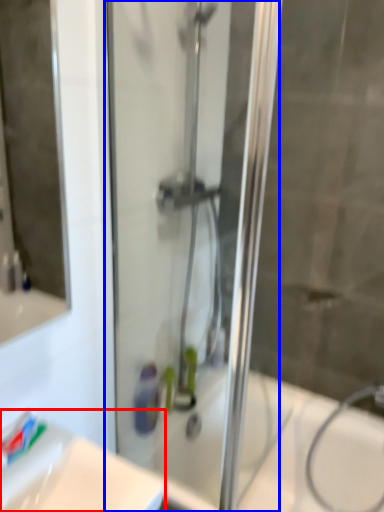
Question: Which object appears farthest to the camera in this image, sink (highlighted by a red box) or screen door (highlighted by a blue box)?

Choices:
 (A) sink
 (B) screen door

Answer: (B)